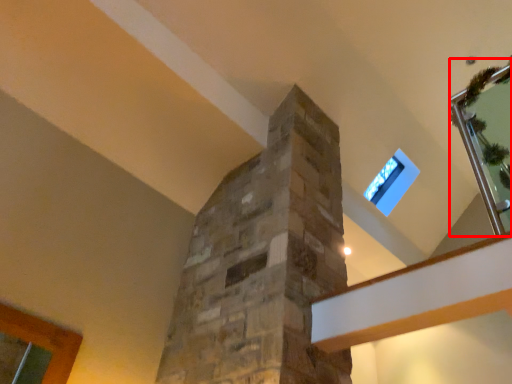
Question: From the image's perspective, what is the correct spatial relationship of glass door (annotated by the red box) in relation to window?

Choices:
 (A) above
 (B) below

Answer: (A)